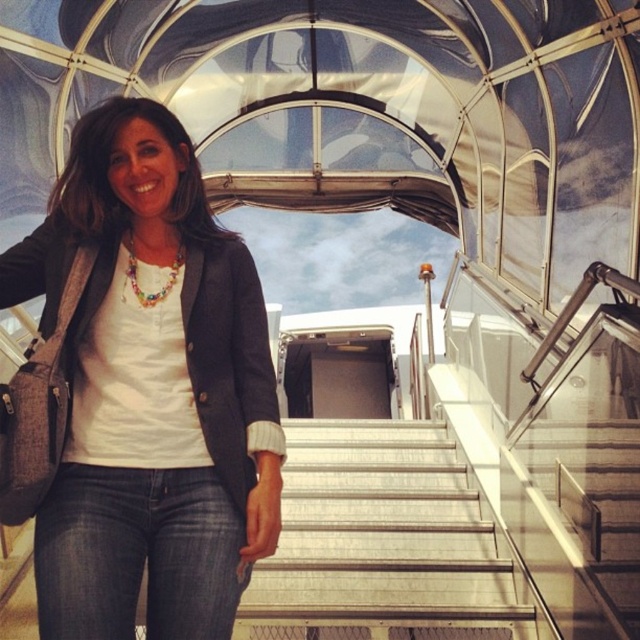
You are a photographer positioned at the entrance of the jet bridge. You want to take a photo that includes both the point at coordinates point (209, 369) and point (282, 531). Which point should you focus on first to ensure both are in focus?

You should focus on point (209, 369) first because it is closer to the camera than point (282, 531). By focusing on the closer point, the farther point will also be within the depth of field, ensuring both are in focus.

You are standing at the entrance of the jet bridge and want to take a photo of the point marked at coordinates (244, 284). If your camera has a maximum focus range of 12 feet, will it be able to focus on that point?

The point marked at coordinates (244, 284) is 12.43 feet away from the camera. Since the camera can only focus up to 12 feet, it will not be able to focus on that point.

You are a flight attendant checking the jet bridge for safety. You notice the metallic silver stairs at center and the dark blue denim jeans at lower center. Which object takes up more space in the image?

The metallic silver stairs at center is larger in size than the dark blue denim jeans at lower center, so the metallic silver stairs at center takes up more space in the image.